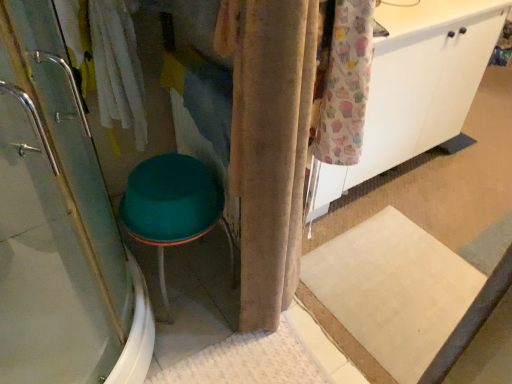
Question: Is teal plastic stool at lower left at the back of white matte cabinet at upper right?

Choices:
 (A) yes
 (B) no

Answer: (B)

Question: Considering the relative sizes of white matte cabinet at upper right and teal plastic stool at lower left in the image provided, is white matte cabinet at upper right wider than teal plastic stool at lower left?

Choices:
 (A) no
 (B) yes

Answer: (A)

Question: Can you confirm if white matte cabinet at upper right is positioned to the left of teal plastic stool at lower left?

Choices:
 (A) yes
 (B) no

Answer: (B)

Question: Is white matte cabinet at upper right shorter than teal plastic stool at lower left?

Choices:
 (A) no
 (B) yes

Answer: (A)

Question: Is white matte cabinet at upper right taller than teal plastic stool at lower left?

Choices:
 (A) yes
 (B) no

Answer: (A)

Question: Considering the relative positions of white matte cabinet at upper right and velvet beige curtain at center in the image provided, is white matte cabinet at upper right to the left or to the right of velvet beige curtain at center?

Choices:
 (A) left
 (B) right

Answer: (B)

Question: In terms of width, does white matte cabinet at upper right look wider or thinner when compared to velvet beige curtain at center?

Choices:
 (A) wide
 (B) thin

Answer: (A)

Question: From a real-world perspective, is white matte cabinet at upper right above or below velvet beige curtain at center?

Choices:
 (A) above
 (B) below

Answer: (A)

Question: In terms of size, does white matte cabinet at upper right appear bigger or smaller than velvet beige curtain at center?

Choices:
 (A) small
 (B) big

Answer: (B)

Question: Is teal plastic stool at lower left spatially inside clear glass shower door at left, or outside of it?

Choices:
 (A) inside
 (B) outside

Answer: (B)

Question: From the image's perspective, relative to clear glass shower door at left, is teal plastic stool at lower left above or below?

Choices:
 (A) above
 (B) below

Answer: (B)

Question: Does point (208, 170) appear closer or farther from the camera than point (51, 72)?

Choices:
 (A) closer
 (B) farther

Answer: (B)

Question: From a real-world perspective, is teal plastic stool at lower left above or below clear glass shower door at left?

Choices:
 (A) above
 (B) below

Answer: (B)

Question: Is velvet beige curtain at center inside or outside of white matte cabinet at upper right?

Choices:
 (A) outside
 (B) inside

Answer: (A)

Question: In the image, is velvet beige curtain at center on the left side or the right side of white matte cabinet at upper right?

Choices:
 (A) left
 (B) right

Answer: (A)